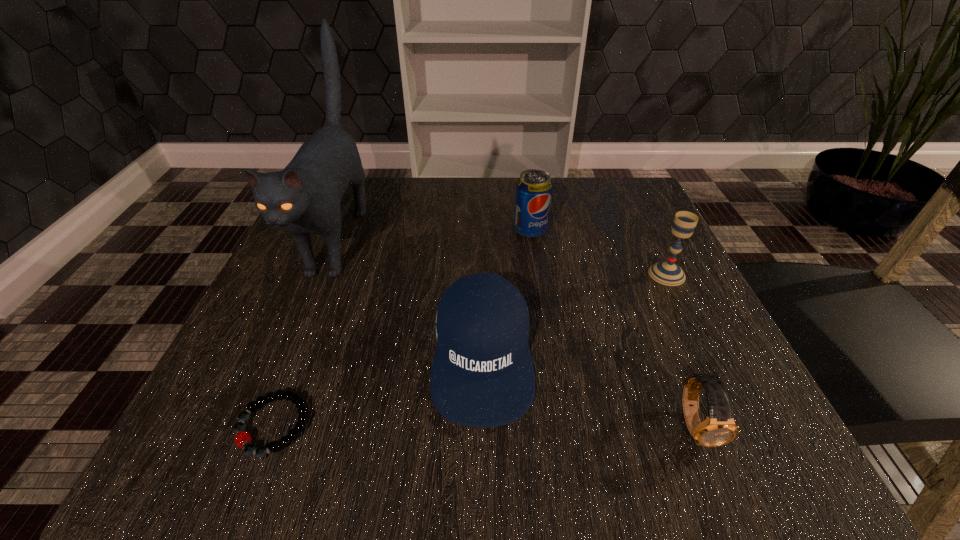
Where is `object situated at the far left corner`? The height and width of the screenshot is (540, 960). object situated at the far left corner is located at coordinates (304, 198).

This screenshot has height=540, width=960. I want to click on object located at the near left corner, so click(x=243, y=439).

This screenshot has width=960, height=540. What are the coordinates of `object that is at the near right corner` in the screenshot? It's located at (719, 428).

Locate an element on the screen. Image resolution: width=960 pixels, height=540 pixels. vacant space at the far edge of the desktop is located at coordinates (432, 202).

Find the location of a particular element. vacant region at the near edge is located at coordinates [568, 443].

The width and height of the screenshot is (960, 540). I want to click on vacant space at the left edge, so click(x=288, y=354).

The image size is (960, 540). In order to click on vacant space at the right edge of the desktop in this screenshot , I will do `click(700, 343)`.

This screenshot has height=540, width=960. Identify the location of vacant space at the far left corner of the desktop. (374, 199).

Image resolution: width=960 pixels, height=540 pixels. Find the location of `blank area at the near left corner`. blank area at the near left corner is located at coordinates (295, 419).

Locate an element on the screen. The height and width of the screenshot is (540, 960). vacant space at the far right corner is located at coordinates (623, 209).